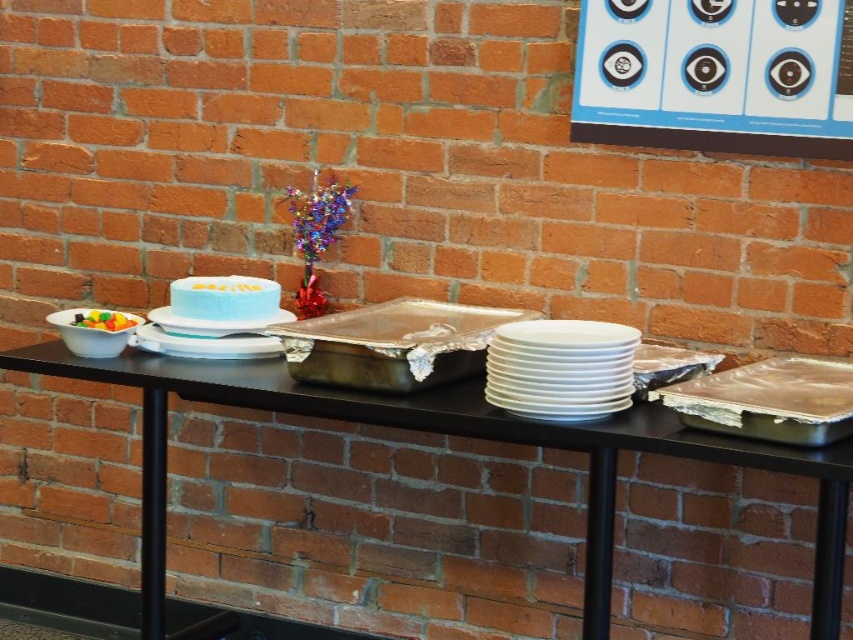
Question: Can you confirm if white matte plates at center is thinner than white matte plate at center?

Choices:
 (A) no
 (B) yes

Answer: (A)

Question: Which of the following is the farthest from the observer?

Choices:
 (A) (602, 584)
 (B) (178, 324)
 (C) (225, 291)
 (D) (784, 429)

Answer: (C)

Question: Is white matte plate stack at right further to the viewer compared to white matte plate at center?

Choices:
 (A) yes
 (B) no

Answer: (B)

Question: Where is white matte plates at center located in relation to white paper targets at upper right in the image?

Choices:
 (A) above
 (B) below

Answer: (B)

Question: Estimate the real-world distances between objects in this image. Which object is closer to the silver/aluminum foil tray at right?

Choices:
 (A) white matte plates at center
 (B) blue frosted cake at center
 (C) white matte plate stack at right

Answer: (C)

Question: Considering the real-world distances, which object is closest to the translucent plastic bowl at left?

Choices:
 (A) white frosted cake at center
 (B) white matte platter at center
 (C) blue frosted cake at center
 (D) silver metallic tray at center

Answer: (B)